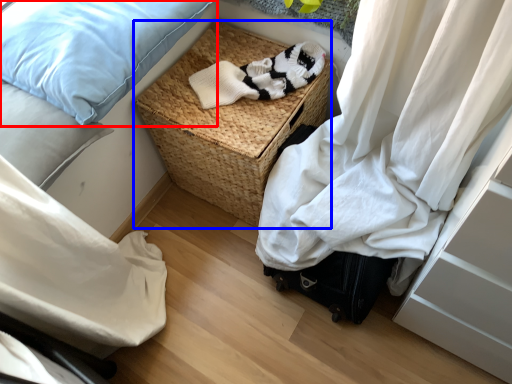
Question: Which object appears closest to the camera in this image, pillow (highlighted by a red box) or picnic basket (highlighted by a blue box)?

Choices:
 (A) pillow
 (B) picnic basket

Answer: (A)